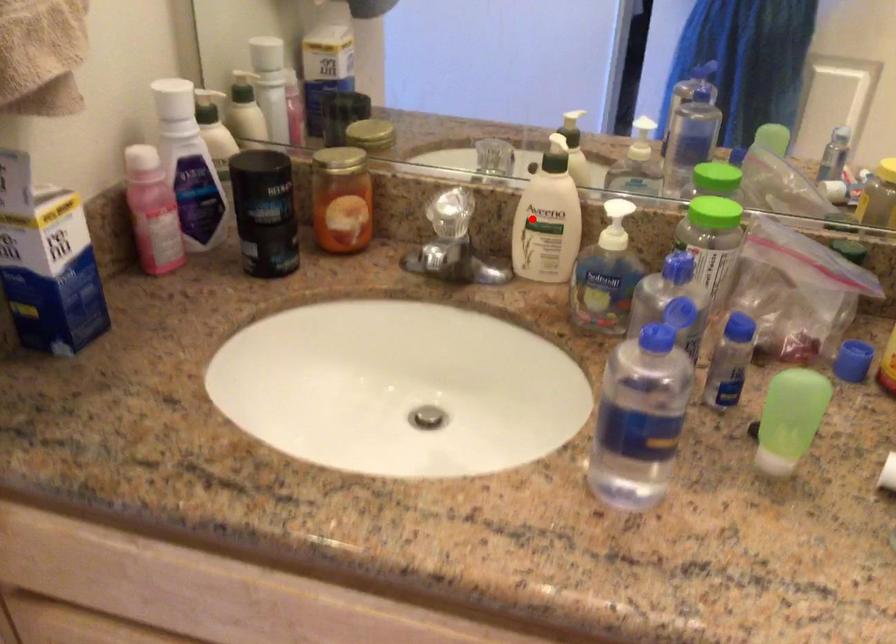
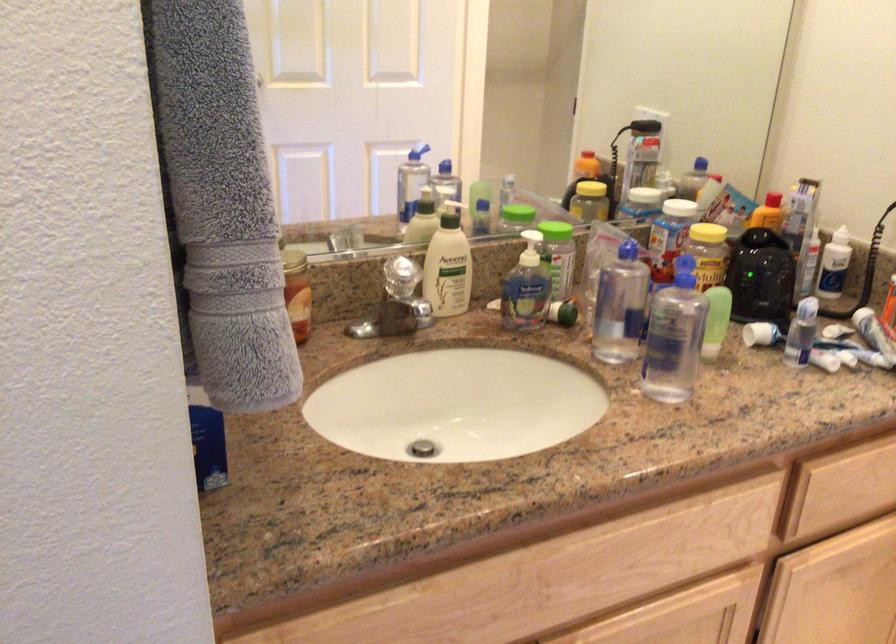
Question: I am providing you with two images of the same scene from different viewpoints. A red point is shown in image1. For the corresponding object point in image2, is it positioned nearer or farther from the camera?

Choices:
 (A) Nearer
 (B) Farther

Answer: (B)